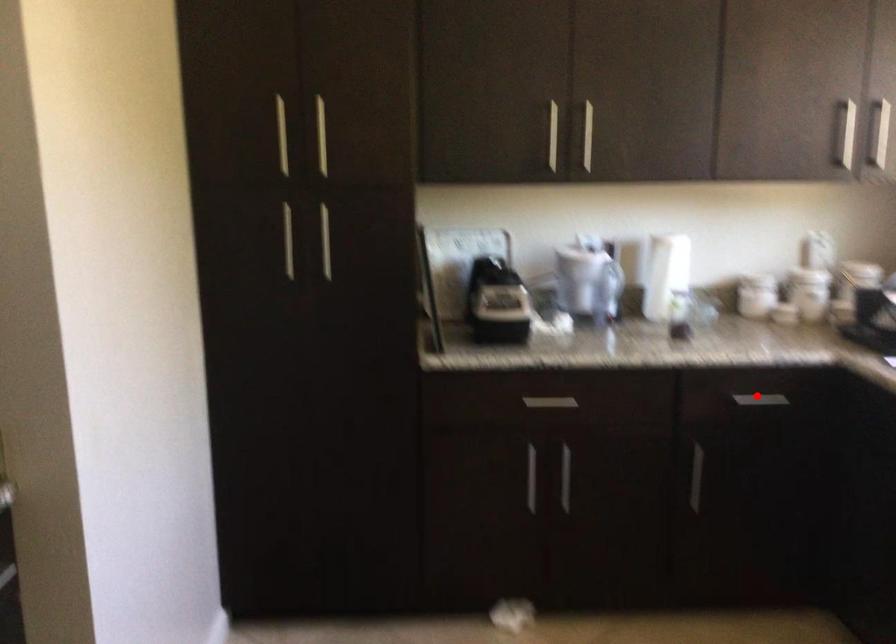
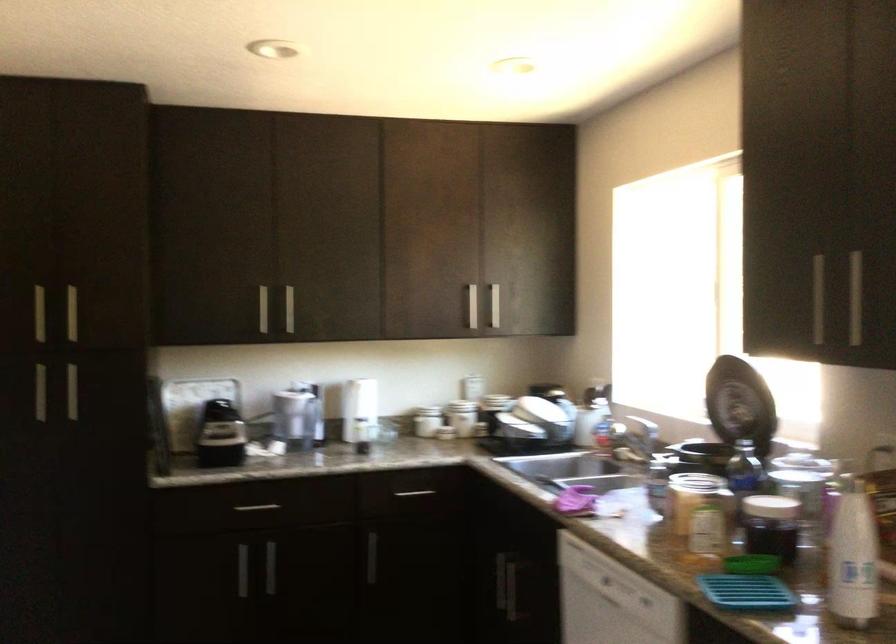
Question: I am providing you with two images of the same scene from different viewpoints. A red point is shown in image1. For the corresponding object point in image2, is it positioned nearer or farther from the camera?

Choices:
 (A) Nearer
 (B) Farther

Answer: (B)